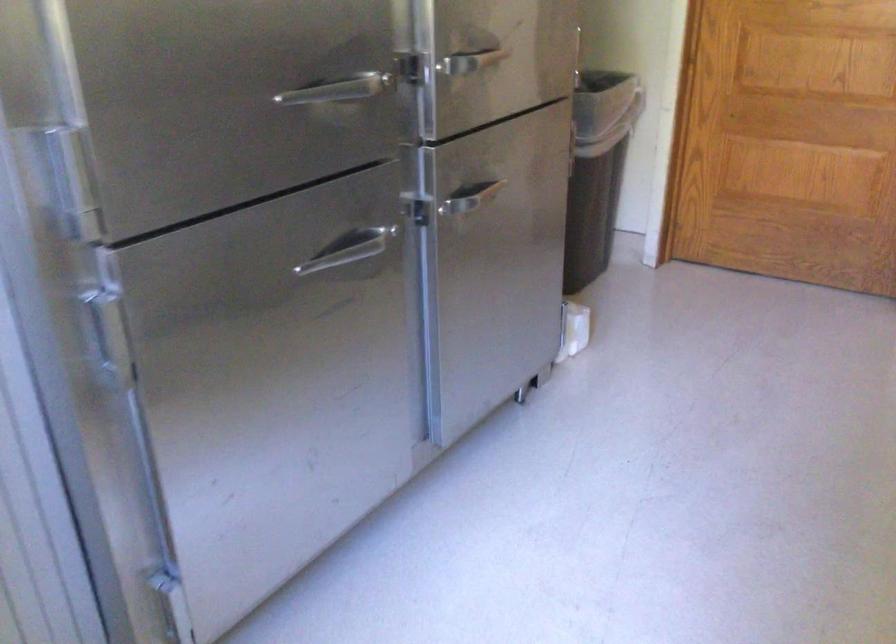
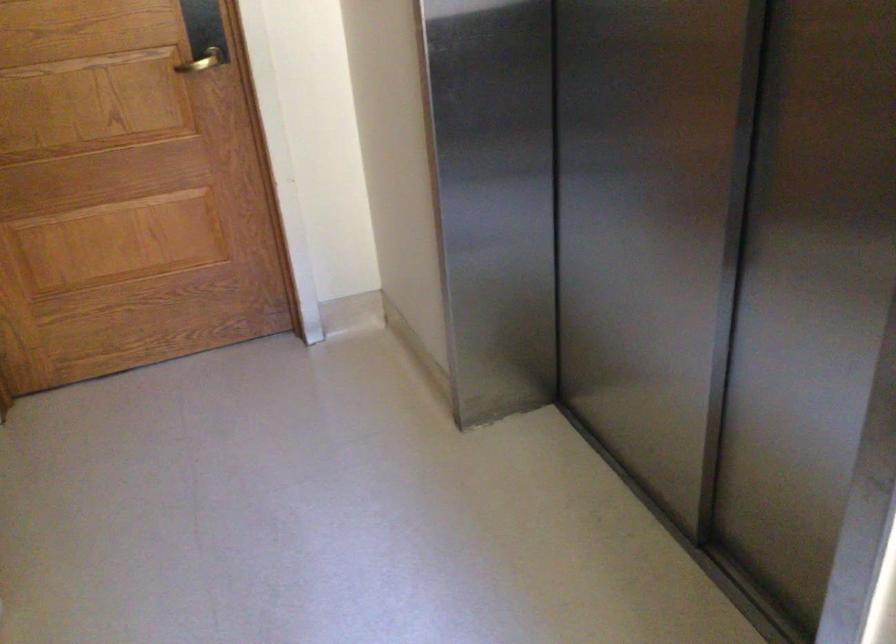
Question: How did the camera likely rotate?

Choices:
 (A) Left
 (B) Right
 (C) Up
 (D) Down

Answer: (B)